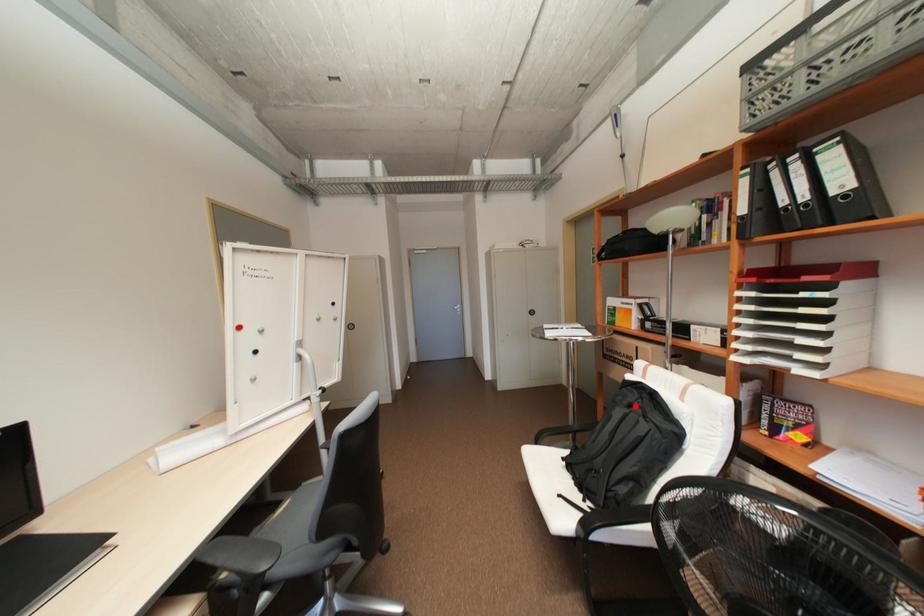
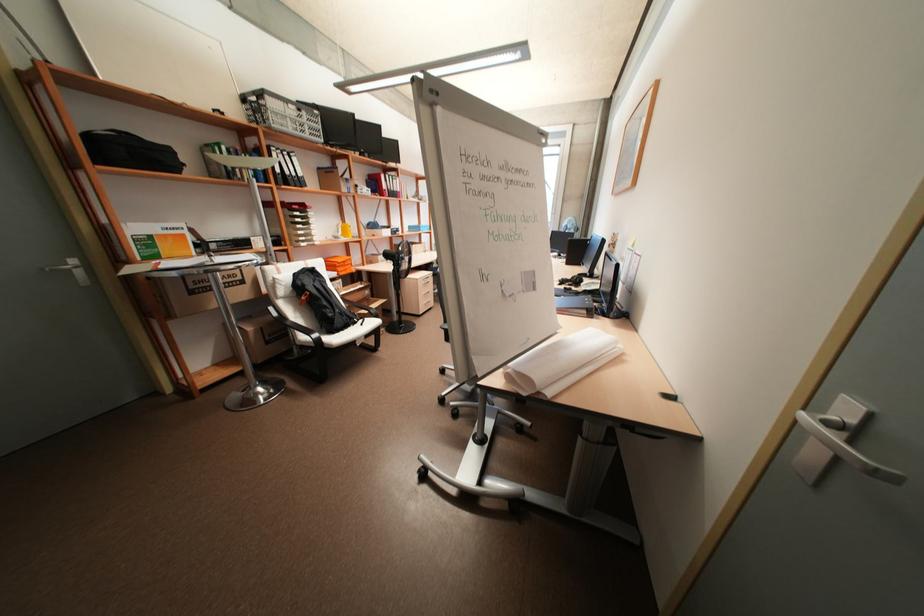
Question: I am providing you with two images of the same scene from different viewpoints. A red point is shown in image1. For the corresponding object point in image2, is it positioned nearer or farther from the camera?

Choices:
 (A) Nearer
 (B) Farther

Answer: (A)